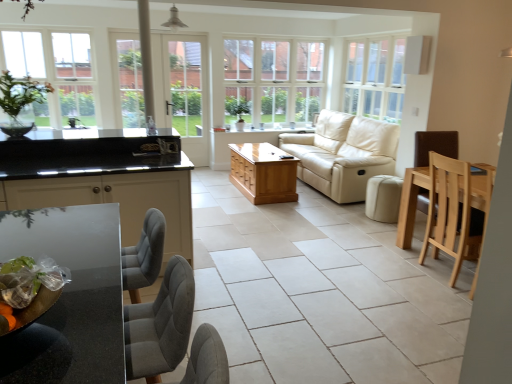
Identify the location of free space to the left of beige leather ottoman at center. Image resolution: width=512 pixels, height=384 pixels. (352, 221).